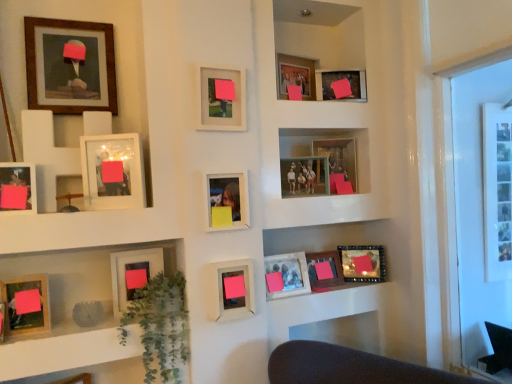
Question: Is matte wooden picture frame at lower left, which is the fifth picture frame from left to right, inside or outside of wooden framed portrait at upper left, the 13th picture frame when ordered from right to left?

Choices:
 (A) outside
 (B) inside

Answer: (A)

Question: In terms of width, does matte wooden picture frame at lower left, which is counted as the eleventh picture frame, starting from the right, look wider or thinner when compared to wooden framed portrait at upper left, the 13th picture frame when ordered from right to left?

Choices:
 (A) thin
 (B) wide

Answer: (B)

Question: Which of these objects is positioned closest to the matte wooden picture frame at lower left, the 14th picture frame when ordered from right to left?

Choices:
 (A) matte plastic photo frame at center, the 7th picture frame when ordered from left to right
 (B) matte wood picture frame at lower center, which is the 8th picture frame from right to left
 (C) wooden photo frame at upper center, which is the sixth picture frame in right-to-left order
 (D) wooden frame at upper left
 (E) matte wooden picture frame at lower center, the fourth picture frame from the right

Answer: (D)

Question: Based on their relative distances, which object is nearer to the wooden frame at center, the 3th picture frame positioned from the right?

Choices:
 (A) matte plastic photo frame at center, the 7th picture frame when ordered from left to right
 (B) matte wooden picture frame at lower left, the 14th picture frame when ordered from right to left
 (C) wooden photo frame at upper center, which ranks as the second picture frame in right-to-left order
 (D) matte glass picture frame at lower right, the 1th picture frame viewed from the right
 (E) pink matte picture frame at center, which is counted as the tenth picture frame, starting from the right

Answer: (C)